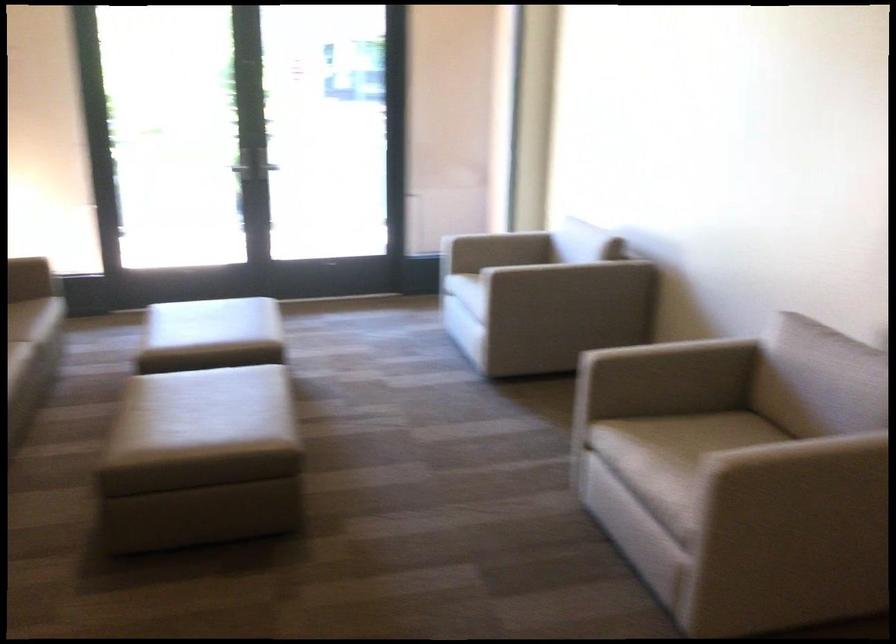
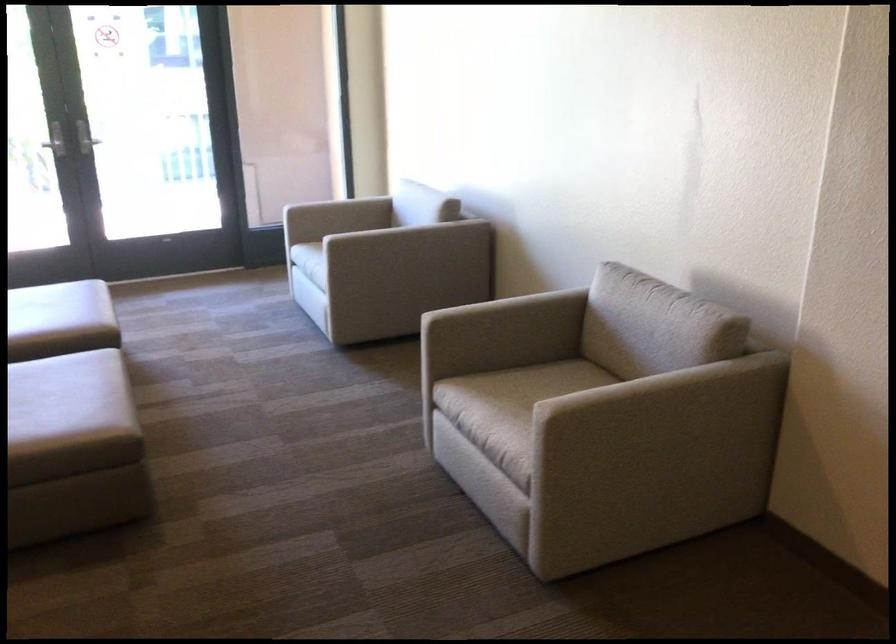
Find the pixel in the second image that matches (478,270) in the first image.

(316, 240)